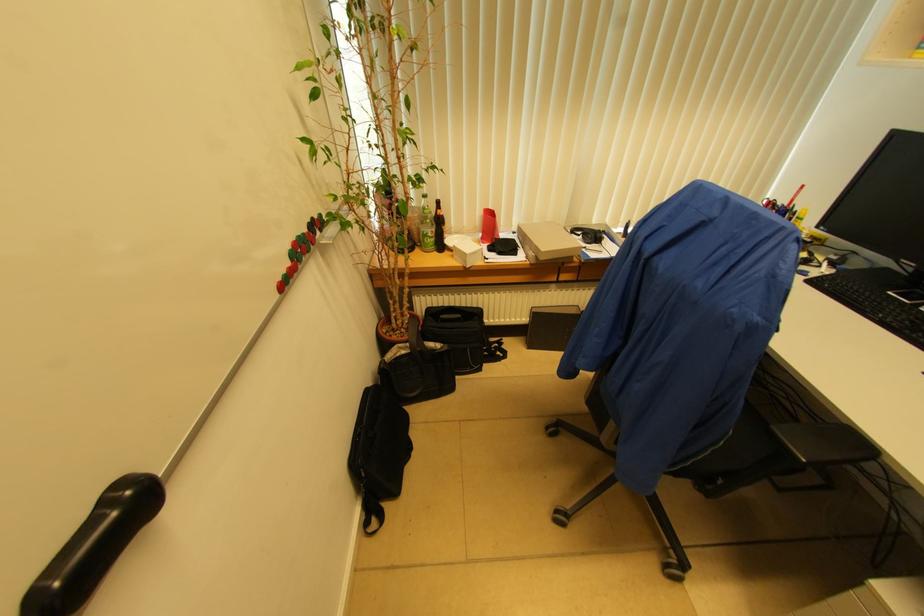
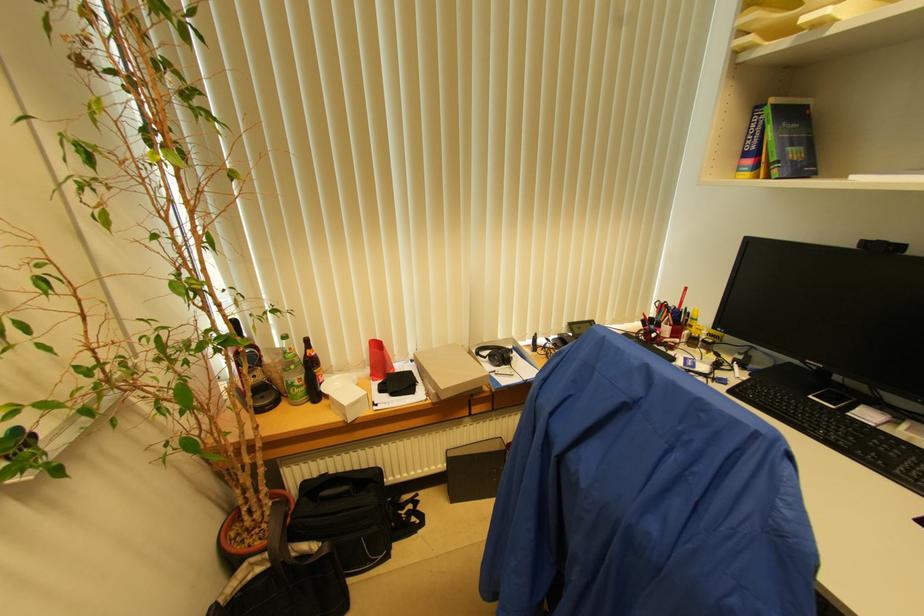
Find the pixel in the second image that matches pixel 435 233 in the first image.

(304, 379)